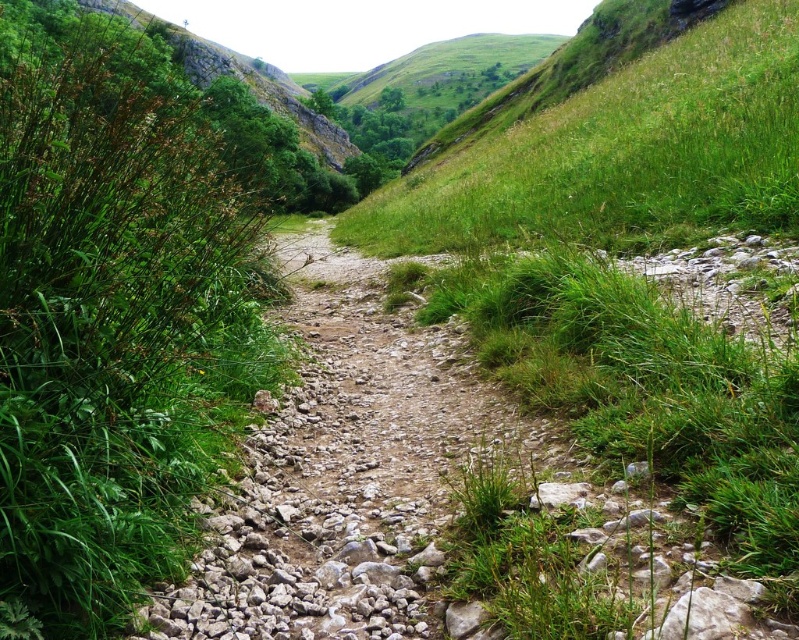
In the scene shown: You are a hiker carrying a heavy backpack and need to cross the narrow rocky path. You notice the green grass at left and the green grassy hillside at upper center. How far apart are these two landmarks to help you navigate?

The green grass at left and the green grassy hillside at upper center are 4.30 meters apart from each other, so you can use this distance to estimate your position along the path.

You are a hiker who wants to cross the path. You notice two areas of green grass at left and green grassy hillside at upper center. Which area has a larger size?

The green grass at left is larger in size than the green grassy hillside at upper center.

You are a hiker standing at the start of the path in the valley. You need to reach the green grassy hillside at upper center. Which direction should you go relative to the green grass at left?

The green grass at left is located above the green grassy hillside at upper center, so you should go downward from the green grass at left to reach the green grassy hillside at upper center.